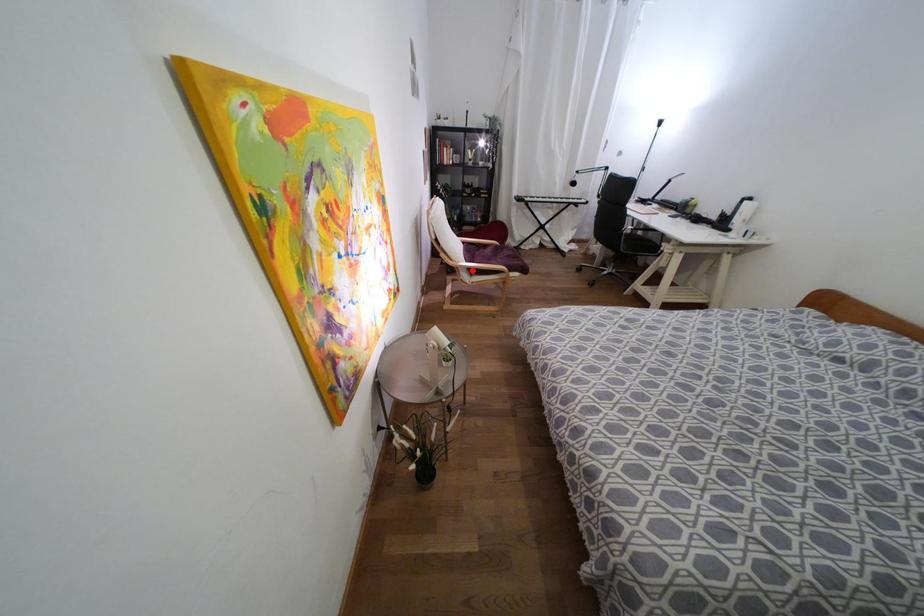
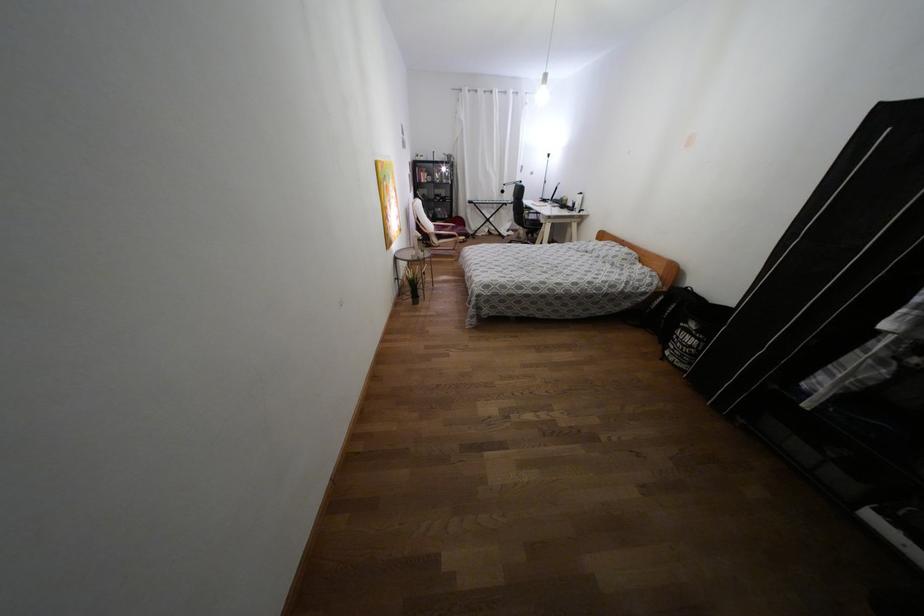
Question: I am providing you with two images of the same scene from different viewpoints. Image1 has a red point marked. In image2, the corresponding 3D location appears at what relative position? Reply with the corresponding letter.

Choices:
 (A) Closer
 (B) Farther

Answer: (A)